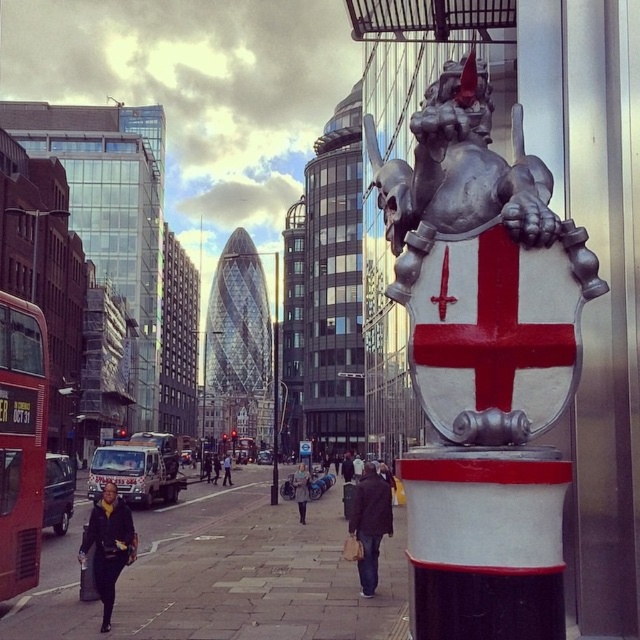
You are a tourist standing on the paved stone sidewalk at lower left and want to take a photo of the silver metallic shield at upper right. Which direction should you turn to face the shield?

You should turn to your right to face the silver metallic shield at upper right since it is located to the right of the paved stone sidewalk at lower left where you are standing.

You are a tourist standing in front of the knight statue in the scene. You want to take a photo of the silver metallic shield at upper right without any obstructions. Considering your current position, is the shield within your reach to photograph clearly?

The silver metallic shield at upper right is 14.17 feet away from viewer, so yes, it is within a reasonable distance to photograph clearly without obstructions.

You are standing at the center of the street looking towards the knight statue. There is a point marked at coordinates (480,260). Which object does this point belong to?

The point at coordinates (480,260) is on the silver metallic shield at upper right.